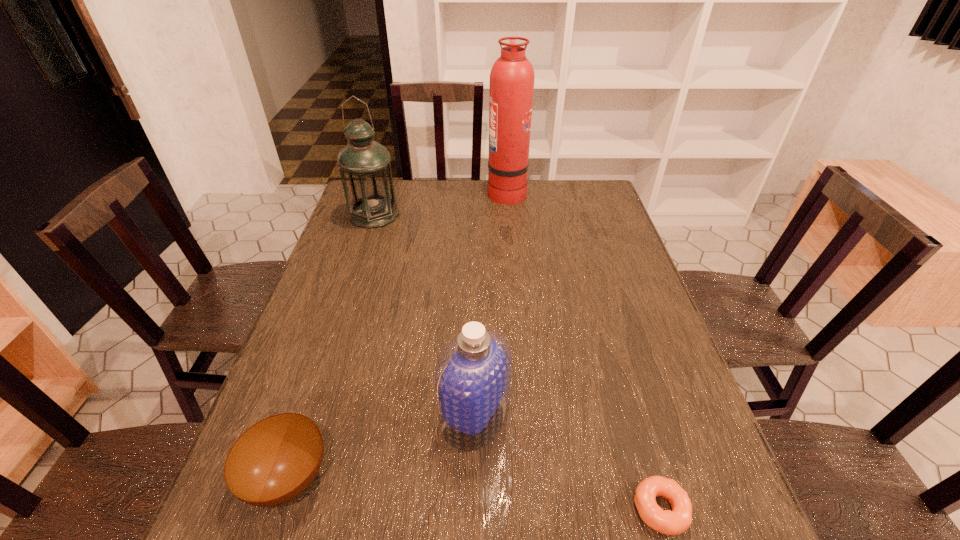
Where is `free area in between the bowl and the shortest object`? The height and width of the screenshot is (540, 960). free area in between the bowl and the shortest object is located at coordinates (474, 494).

Find the location of `free area in between the oil lamp and the shortest object`. free area in between the oil lamp and the shortest object is located at coordinates (517, 362).

Identify the location of empty space between the tallest object and the oil lamp. The width and height of the screenshot is (960, 540). (441, 203).

You are a GUI agent. You are given a task and a screenshot of the screen. Output one action in this format:
    pyautogui.click(x=<x>, y=<y>)
    Task: Click on the empty space between the fourth shortest object and the doughnut
    This screenshot has height=540, width=960.
    Given the screenshot: What is the action you would take?
    pyautogui.click(x=517, y=362)

Locate an element on the screen. This screenshot has width=960, height=540. object that stands as the closest to the rightmost object is located at coordinates (472, 383).

Locate an element on the screen. This screenshot has width=960, height=540. the second closest object to the shortest object is located at coordinates (275, 460).

Image resolution: width=960 pixels, height=540 pixels. I want to click on free point that satisfies the following two spatial constraints: 1. on the front side of the third shortest object; 2. on the left side of the oil lamp, so 308,415.

Where is `free spot that satisfies the following two spatial constraints: 1. on the back side of the doughnut; 2. on the label side of the fire extinguisher`? This screenshot has height=540, width=960. free spot that satisfies the following two spatial constraints: 1. on the back side of the doughnut; 2. on the label side of the fire extinguisher is located at coordinates (567, 192).